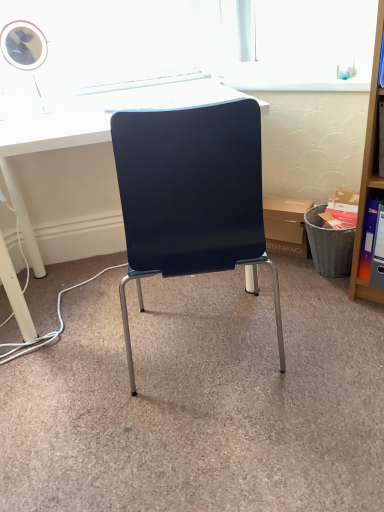
At what (x,y) coordinates should I click in order to perform the action: click on vacant space in front of white glossy desk at center. Please return your answer as a coordinate pair (x, y). The image size is (384, 512). Looking at the image, I should click on (144, 416).